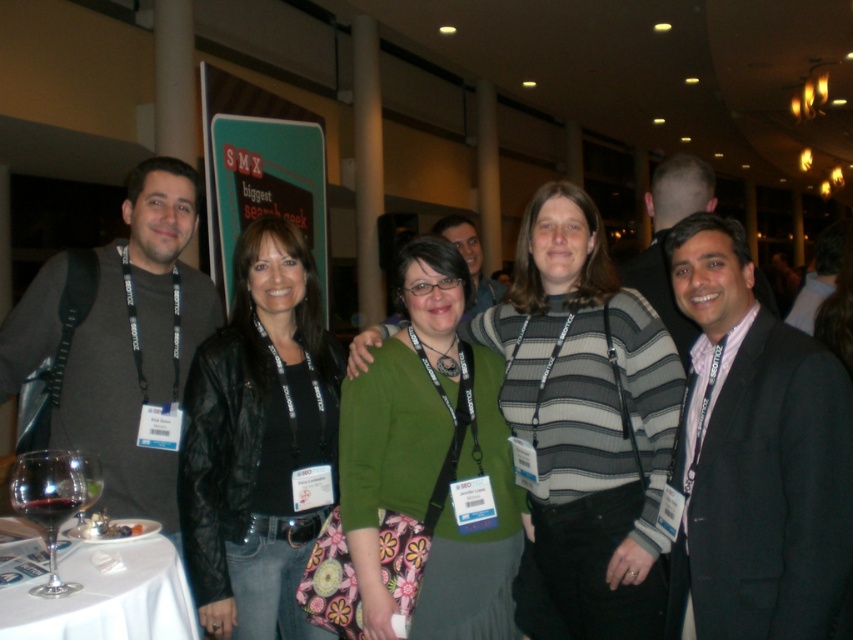
You are standing in the hall and want to take a photo of the green fabric sweater at center. Where should you position yourself to capture it in the frame?

The green fabric sweater at center is located at point 0.717 on the x axis and 0.506 on the y axis, so you should position yourself facing the center area slightly to the right to capture it in the frame.

You are organizing a photo shoot and need to ensure that the green fabric sweater at center and the white cloth table at lower left are visible in the frame. Based on their sizes, which object would require more horizontal space in the photograph?

The green fabric sweater at center requires more horizontal space in the photograph because its width surpasses that of the white cloth table at lower left.